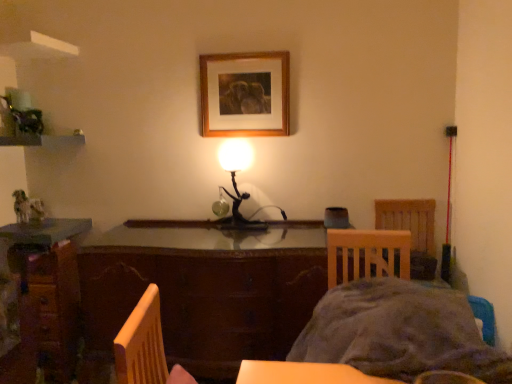
Question: Choose the correct answer: Is brown wooden table at center inside wooden chair at right or outside it?

Choices:
 (A) outside
 (B) inside

Answer: (A)

Question: From a real-world perspective, is brown wooden table at center above or below wooden chair at right?

Choices:
 (A) above
 (B) below

Answer: (B)

Question: Which of these objects is positioned closest to the wooden desk at lower left?

Choices:
 (A) wooden picture frame at upper center
 (B) brown wooden table at center
 (C) metallic black lamp at center
 (D) wooden chair at right
 (E) gray fabric bed at lower right

Answer: (B)

Question: Which object is positioned farthest from the wooden chair at right?

Choices:
 (A) gray fabric bed at lower right
 (B) wooden desk at lower left
 (C) metallic black lamp at center
 (D) brown wooden table at center
 (E) wooden picture frame at upper center

Answer: (B)